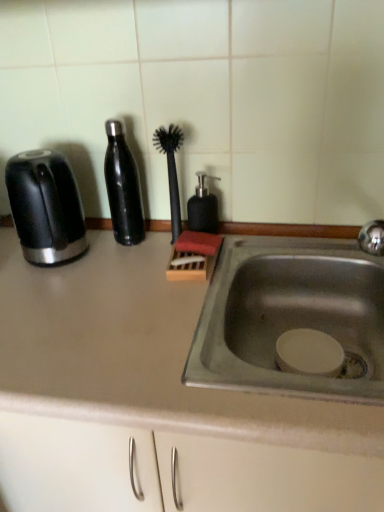
Where is `vacant space situated on the left part of black rubber brush at center`? vacant space situated on the left part of black rubber brush at center is located at coordinates (118, 258).